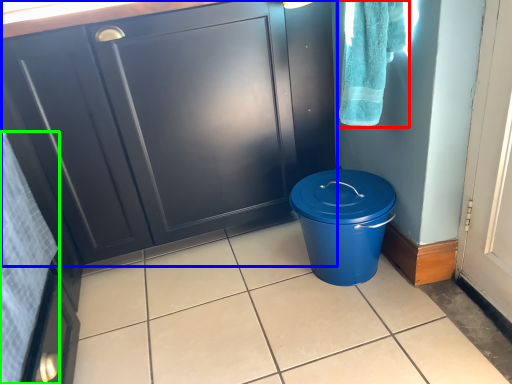
Question: Based on their relative distances, which object is nearer to bath towel (highlighted by a red box)? Choose from cabinetry (highlighted by a blue box) and bath towel (highlighted by a green box).

Choices:
 (A) cabinetry
 (B) bath towel

Answer: (A)